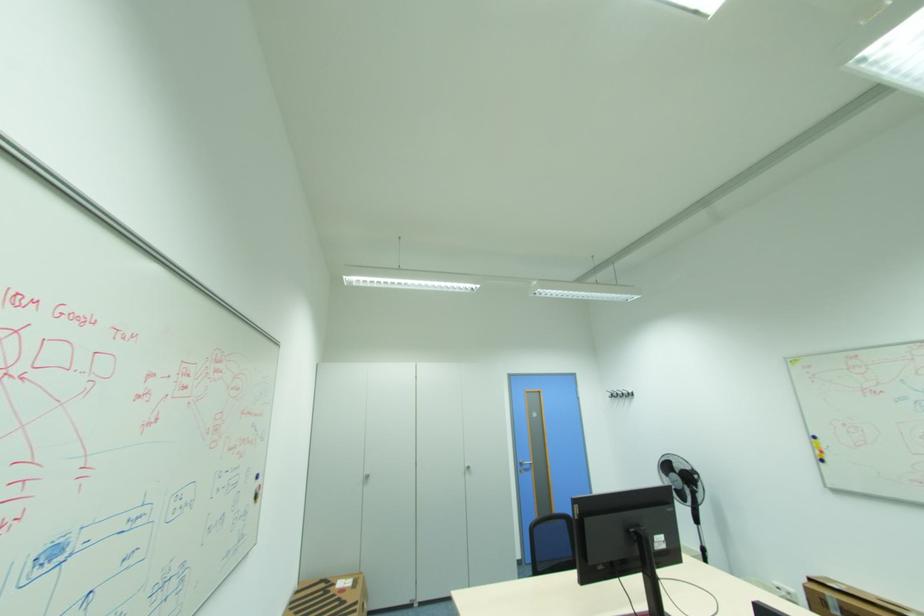
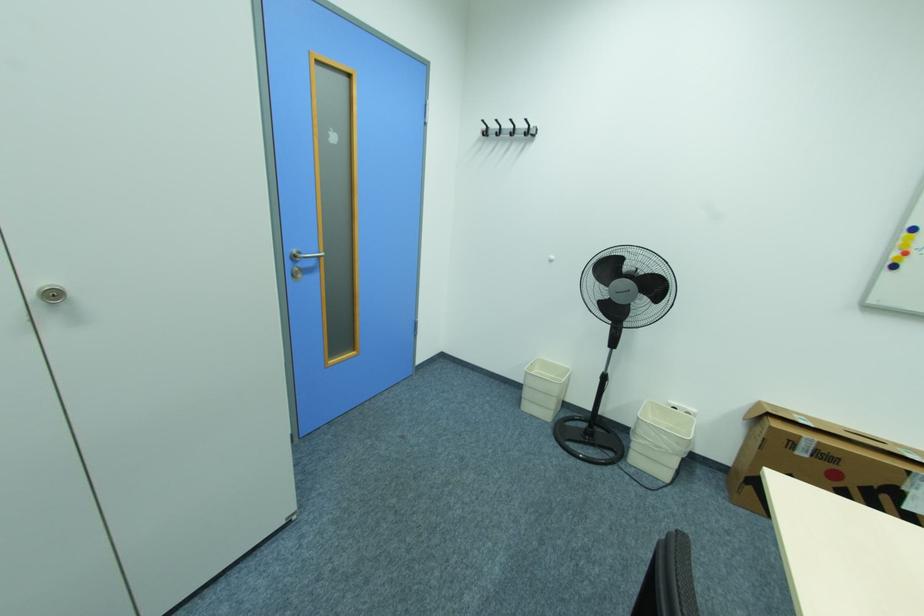
The point at [827,453] is marked in the first image. Where is the corresponding point in the second image?

(910, 253)